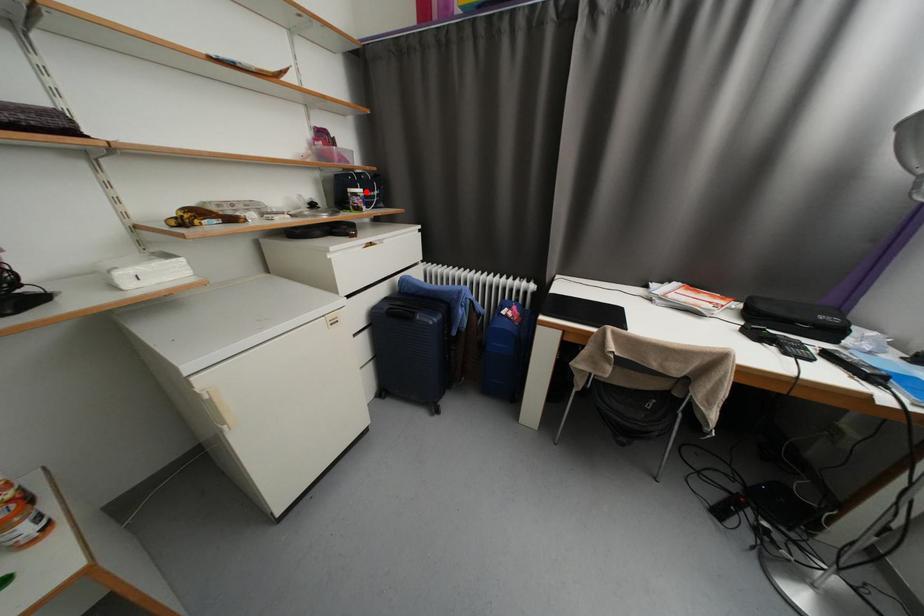
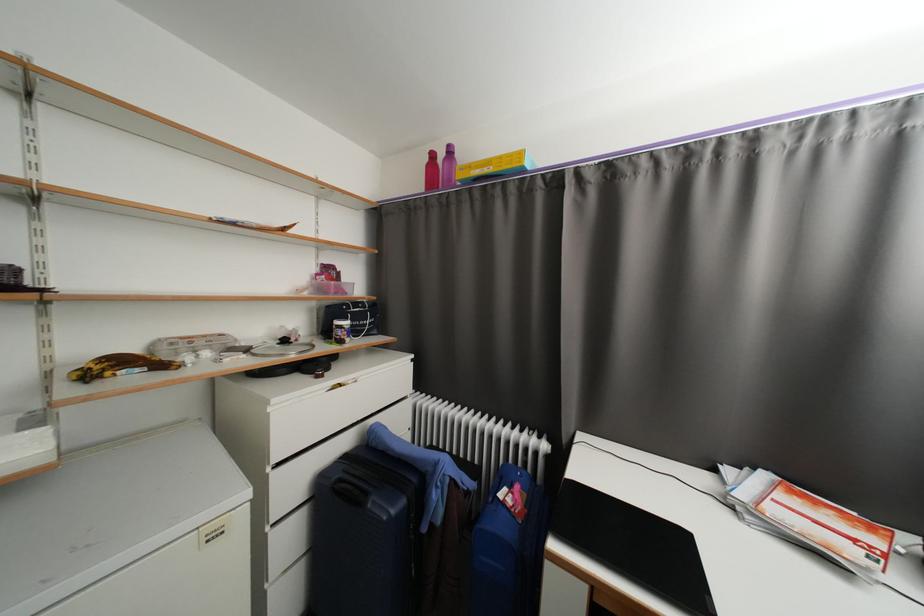
In the second image, find the point that corresponds to the highlighted location in the first image.

(353, 323)